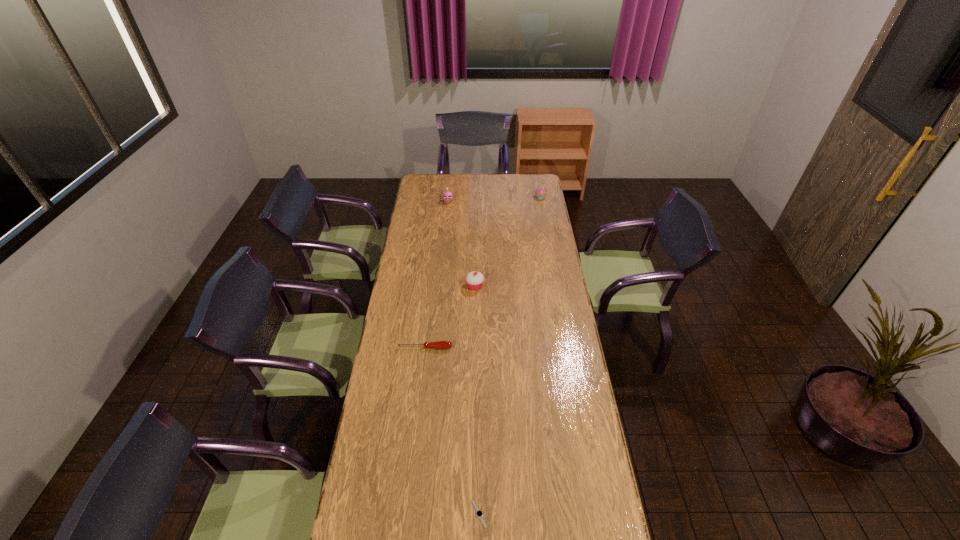
Image resolution: width=960 pixels, height=540 pixels. What are the coordinates of `the rightmost object` in the screenshot? It's located at (540, 192).

Locate an element on the screen. The image size is (960, 540). the leftmost cupcake is located at coordinates (447, 196).

The image size is (960, 540). I want to click on the third farthest object, so click(474, 279).

At what (x,y) coordinates should I click in order to perform the action: click on the second cupcake from left to right. Please return your answer as a coordinate pair (x, y). The height and width of the screenshot is (540, 960). Looking at the image, I should click on point(474,279).

The image size is (960, 540). I want to click on screwdriver, so click(x=439, y=344).

Locate an element on the screen. the second shortest object is located at coordinates (439, 344).

Identify the location of the shortest object. (479, 513).

Find the location of `the nearest object`. the nearest object is located at coordinates (479, 513).

Identify the location of free space located on the back of the rightmost object. The width and height of the screenshot is (960, 540). (538, 182).

Locate an element on the screen. Image resolution: width=960 pixels, height=540 pixels. vacant space located 0.200m on the face of the leftmost cupcake is located at coordinates (446, 225).